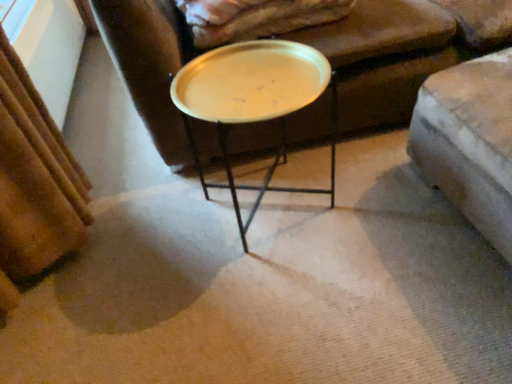
Locate an element on the screen. This screenshot has height=384, width=512. vacant space to the left of metallic gold tray at center is located at coordinates (155, 240).